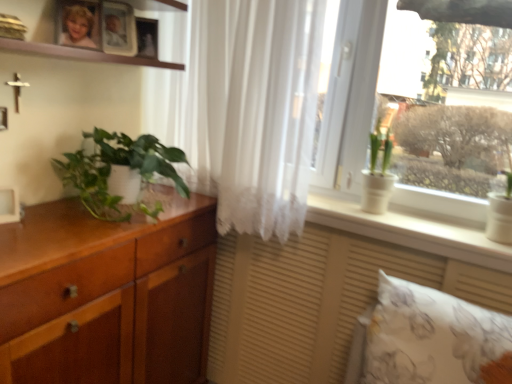
Image resolution: width=512 pixels, height=384 pixels. What do you see at coordinates (147, 37) in the screenshot? I see `matte wooden picture frame at upper center, which is the third picture frame in front-to-back order` at bounding box center [147, 37].

The image size is (512, 384). In order to click on white matte picture frame at left, marked as the first picture frame in a front-to-back arrangement in this screenshot , I will do `click(9, 206)`.

What do you see at coordinates (434, 338) in the screenshot? I see `white floral fabric pillow at lower right` at bounding box center [434, 338].

This screenshot has width=512, height=384. What do you see at coordinates (242, 107) in the screenshot?
I see `white sheer curtain at center` at bounding box center [242, 107].

This screenshot has width=512, height=384. What do you see at coordinates (106, 297) in the screenshot?
I see `wooden cabinet at left` at bounding box center [106, 297].

This screenshot has height=384, width=512. What are the coordinates of `wooden cabinet at left` in the screenshot? It's located at (106, 297).

The height and width of the screenshot is (384, 512). Find the location of `matte wooden picture frame at upper center, which is the third picture frame in front-to-back order`. matte wooden picture frame at upper center, which is the third picture frame in front-to-back order is located at coordinates (147, 37).

Is wooden picture frame at upper center, placed as the second picture frame when sorted from back to front, surrounded by white matte picture frame at left, marked as the first picture frame in a front-to-back arrangement?

No, wooden picture frame at upper center, placed as the second picture frame when sorted from back to front, is located outside of white matte picture frame at left, marked as the first picture frame in a front-to-back arrangement.

Is white matte picture frame at left, the 3th picture frame viewed from the top, shorter than wooden picture frame at upper center, placed as the second picture frame when sorted from back to front?

Yes, white matte picture frame at left, the 3th picture frame viewed from the top, is shorter than wooden picture frame at upper center, placed as the second picture frame when sorted from back to front.

Who is more distant, white matte picture frame at left, which is the 1th picture frame from left to right, or wooden picture frame at upper center, acting as the second picture frame starting from the top?

wooden picture frame at upper center, acting as the second picture frame starting from the top.

How distant is blonde hair photo at upper left from green glossy plant at left, arranged as the 2th houseplant when viewed from the right?

blonde hair photo at upper left and green glossy plant at left, arranged as the 2th houseplant when viewed from the right, are 45.19 centimeters apart.

Which of these two, blonde hair photo at upper left or green glossy plant at left, arranged as the 2th houseplant when viewed from the right, stands shorter?

Standing shorter between the two is blonde hair photo at upper left.

Is blonde hair photo at upper left not within green glossy plant at left, which is the 1th houseplant in left-to-right order?

Yes, blonde hair photo at upper left is located beyond the bounds of green glossy plant at left, which is the 1th houseplant in left-to-right order.

Which of these two, blonde hair photo at upper left or green glossy plant at left, which is the 1th houseplant in left-to-right order, is wider?

green glossy plant at left, which is the 1th houseplant in left-to-right order, is wider.

From a real-world perspective, which object rests below the other?

white floral fabric pillow at lower right, from a real-world perspective.

Which object is wider, white matte picture frame at left, marked as the first picture frame in a front-to-back arrangement, or white floral fabric pillow at lower right?

white floral fabric pillow at lower right.

Considering the positions of points (9, 215) and (383, 339), is point (9, 215) closer to camera compared to point (383, 339)?

Yes, it is in front of point (383, 339).

Could you tell me if white matte picture frame at left, which is the 1th picture frame from left to right, is facing white floral fabric pillow at lower right?

No, white matte picture frame at left, which is the 1th picture frame from left to right, is not aimed at white floral fabric pillow at lower right.

You are a GUI agent. You are given a task and a screenshot of the screen. Output one action in this format:
    pyautogui.click(x=<x>, y=<y>)
    Task: Click on the vanity directly beneath the blonde hair photo at upper left (from a real-world perspective)
    The image size is (512, 384).
    Given the screenshot: What is the action you would take?
    pyautogui.click(x=335, y=287)

From the image's perspective, is blonde hair photo at upper left above or below matte wood vanity at lower center?

blonde hair photo at upper left is situated higher than matte wood vanity at lower center in the image.

Which object is further away from the camera, blonde hair photo at upper left or matte wood vanity at lower center?

blonde hair photo at upper left is further away from the camera.

Does point (97, 134) appear closer or farther from the camera than point (129, 38)?

Point (97, 134).

From a real-world perspective, which object rests below the other?

green glossy plant at left, arranged as the 2th houseplant when viewed from the right.

Would you say green glossy plant at left, arranged as the 2th houseplant when viewed from the right, is a long distance from wooden picture frame at upper center, which is counted as the 2th picture frame, starting from the right?

That's not correct — green glossy plant at left, arranged as the 2th houseplant when viewed from the right, is a little close to wooden picture frame at upper center, which is counted as the 2th picture frame, starting from the right.

What's the angular difference between green glossy plant at left, which is the 1th houseplant in left-to-right order, and wooden picture frame at upper center, which is the second picture frame from left to right,'s facing directions?

The facing directions of green glossy plant at left, which is the 1th houseplant in left-to-right order, and wooden picture frame at upper center, which is the second picture frame from left to right, are 33.4 degrees apart.

In the scene shown: Is wooden cabinet at left in contact with wooden picture frame at upper center, placed as the second picture frame when sorted from back to front?

wooden cabinet at left is not next to wooden picture frame at upper center, placed as the second picture frame when sorted from back to front, and they're not touching.

Does point (142, 236) appear closer or farther from the camera than point (125, 49)?

Point (142, 236) is positioned closer to the camera compared to point (125, 49).

Considering the sizes of objects wooden cabinet at left and wooden picture frame at upper center, which ranks as the 2th picture frame in front-to-back order, in the image provided, who is smaller, wooden cabinet at left or wooden picture frame at upper center, which ranks as the 2th picture frame in front-to-back order,?

wooden picture frame at upper center, which ranks as the 2th picture frame in front-to-back order, is smaller.

Which picture frame is the 2nd one when counting from the back of the wooden cabinet at left? Please provide its 2D coordinates.

[(118, 29)]

Based on the photo, is matte wood vanity at lower center at the back of wooden cabinet at left?

wooden cabinet at left does not have its back to matte wood vanity at lower center.

Are wooden cabinet at left and matte wood vanity at lower center beside each other?

No.

You are a GUI agent. You are given a task and a screenshot of the screen. Output one action in this format:
    pyautogui.click(x=<x>, y=<y>)
    Task: Click on the cabinetry that is above the matte wood vanity at lower center (from a real-world perspective)
    The height and width of the screenshot is (384, 512).
    Given the screenshot: What is the action you would take?
    pyautogui.click(x=106, y=297)

How much distance is there between wooden cabinet at left and matte wood vanity at lower center?

wooden cabinet at left is 54.79 centimeters from matte wood vanity at lower center.

You are a GUI agent. You are given a task and a screenshot of the screen. Output one action in this format:
    pyautogui.click(x=<x>, y=<y>)
    Task: Click on the 1st picture frame above the white matte picture frame at left, which ranks as the third picture frame in right-to-left order (from the image's perspective)
    The width and height of the screenshot is (512, 384).
    Given the screenshot: What is the action you would take?
    pyautogui.click(x=118, y=29)

From the image's perspective, starting from the blonde hair photo at upper left, which houseplant is the 2nd one below? Please provide its 2D coordinates.

[(118, 165)]

Estimate the real-world distances between objects in this image. Which object is further from white sheer curtain at center, wooden cabinet at left or white ceramic pot at window, positioned as the first houseplant in right-to-left order?

white ceramic pot at window, positioned as the first houseplant in right-to-left order, is further to white sheer curtain at center.

Estimate the real-world distances between objects in this image. Which object is closer to green glossy plant at left, which is the 1th houseplant in left-to-right order, white ceramic pot at window, the second houseplant when ordered from left to right, or white sheer curtain at center?

Based on the image, white sheer curtain at center appears to be nearer to green glossy plant at left, which is the 1th houseplant in left-to-right order.

Considering their positions, is blonde hair photo at upper left positioned further to matte wood vanity at lower center than wooden cabinet at left?

blonde hair photo at upper left is further to matte wood vanity at lower center.

Estimate the real-world distances between objects in this image. Which object is closer to wooden picture frame at upper center, which ranks as the 2th picture frame in front-to-back order, blonde hair photo at upper left or white ceramic pot at window, the second houseplant when ordered from left to right?

Based on the image, blonde hair photo at upper left appears to be nearer to wooden picture frame at upper center, which ranks as the 2th picture frame in front-to-back order.

Which object lies nearer to the anchor point blonde hair photo at upper left, white floral fabric pillow at lower right or white ceramic pot at window, positioned as the first houseplant in right-to-left order?

white ceramic pot at window, positioned as the first houseplant in right-to-left order.

Based on their spatial positions, is matte wood vanity at lower center or white ceramic pot at window, the second houseplant when ordered from left to right, further from blonde hair photo at upper left?

matte wood vanity at lower center is positioned further to the anchor blonde hair photo at upper left.

When comparing their distances from blonde hair photo at upper left, does green glossy plant at left, arranged as the 2th houseplant when viewed from the right, or white sheer curtain at center seem closer?

Based on the image, green glossy plant at left, arranged as the 2th houseplant when viewed from the right, appears to be nearer to blonde hair photo at upper left.

Based on their spatial positions, is green glossy plant at left, arranged as the 2th houseplant when viewed from the right, or white ceramic pot at window, positioned as the first houseplant in right-to-left order, closer to matte wood vanity at lower center?

Based on the image, white ceramic pot at window, positioned as the first houseplant in right-to-left order, appears to be nearer to matte wood vanity at lower center.

Locate an element on the screen. The width and height of the screenshot is (512, 384). vanity between wooden cabinet at left and white floral fabric pillow at lower right from left to right is located at coordinates (335, 287).

This screenshot has height=384, width=512. Identify the location of curtain between green glossy plant at left, which is the 1th houseplant in left-to-right order, and white floral fabric pillow at lower right, in the horizontal direction. (242, 107).

The height and width of the screenshot is (384, 512). Identify the location of person between wooden cabinet at left and white ceramic pot at window, positioned as the first houseplant in right-to-left order, in the horizontal direction. (77, 26).

This screenshot has width=512, height=384. Find the location of `houseplant situated between wooden picture frame at upper center, which appears as the 2th picture frame when ordered from the bottom, and white ceramic pot at window, the second houseplant when ordered from left to right, from left to right`. houseplant situated between wooden picture frame at upper center, which appears as the 2th picture frame when ordered from the bottom, and white ceramic pot at window, the second houseplant when ordered from left to right, from left to right is located at coordinates (118, 165).